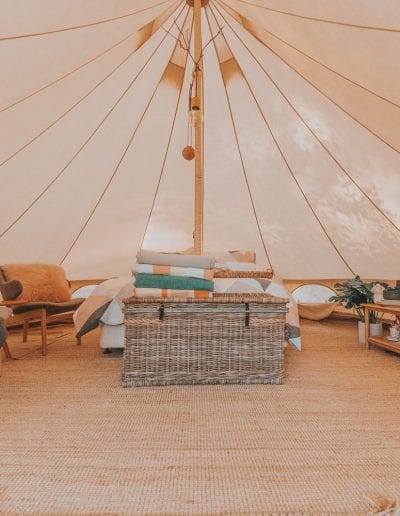
The height and width of the screenshot is (516, 400). In order to click on plant pot in this screenshot , I will do `click(375, 329)`.